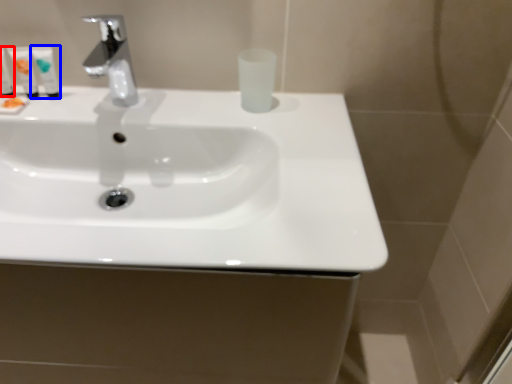
Question: Which point is closer to the camera, mouthwash (highlighted by a red box) or mouthwash (highlighted by a blue box)?

Choices:
 (A) mouthwash
 (B) mouthwash

Answer: (A)